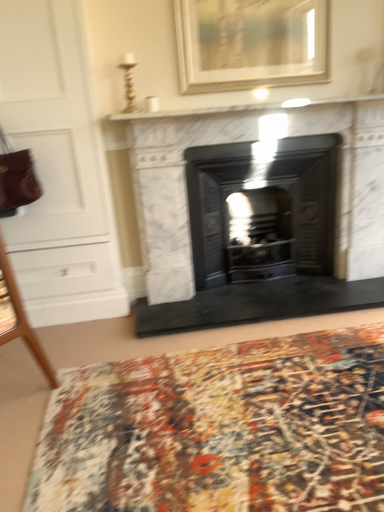
Question: Is multicolored woven mat at lower center aimed at matte black wood burning stove at center?

Choices:
 (A) yes
 (B) no

Answer: (B)

Question: Can you confirm if multicolored woven mat at lower center is wider than matte black wood burning stove at center?

Choices:
 (A) no
 (B) yes

Answer: (B)

Question: Would you say multicolored woven mat at lower center contains matte black wood burning stove at center?

Choices:
 (A) yes
 (B) no

Answer: (B)

Question: From the image's perspective, is multicolored woven mat at lower center located beneath matte black wood burning stove at center?

Choices:
 (A) yes
 (B) no

Answer: (A)

Question: Can you confirm if multicolored woven mat at lower center is thinner than matte black wood burning stove at center?

Choices:
 (A) yes
 (B) no

Answer: (B)

Question: From the image's perspective, is multicolored woven rug at center above or below multicolored woven mat at lower center?

Choices:
 (A) below
 (B) above

Answer: (B)

Question: From their relative heights in the image, would you say multicolored woven rug at center is taller or shorter than multicolored woven mat at lower center?

Choices:
 (A) tall
 (B) short

Answer: (A)

Question: Is multicolored woven rug at center inside the boundaries of multicolored woven mat at lower center, or outside?

Choices:
 (A) outside
 (B) inside

Answer: (A)

Question: In the image, is multicolored woven rug at center positioned in front of or behind multicolored woven mat at lower center?

Choices:
 (A) behind
 (B) front

Answer: (A)

Question: From a real-world perspective, is white marble shelf at upper center physically located above or below multicolored woven mat at lower center?

Choices:
 (A) above
 (B) below

Answer: (A)

Question: In the image, is white marble shelf at upper center positioned in front of or behind multicolored woven mat at lower center?

Choices:
 (A) front
 (B) behind

Answer: (B)

Question: In terms of width, does white marble shelf at upper center look wider or thinner when compared to multicolored woven mat at lower center?

Choices:
 (A) thin
 (B) wide

Answer: (A)

Question: Is point (228, 111) positioned closer to the camera than point (198, 412)?

Choices:
 (A) closer
 (B) farther

Answer: (B)

Question: Does point (246, 415) appear closer or farther from the camera than point (200, 112)?

Choices:
 (A) closer
 (B) farther

Answer: (A)

Question: From the image's perspective, is multicolored woven mat at lower center above or below white marble shelf at upper center?

Choices:
 (A) above
 (B) below

Answer: (B)